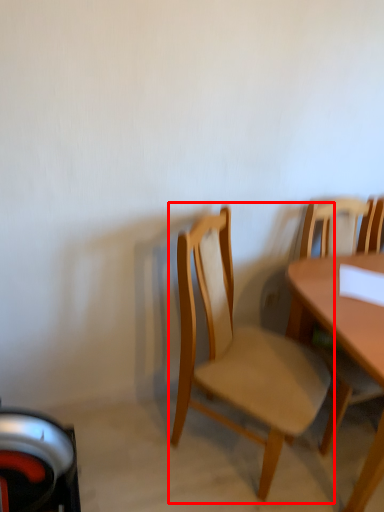
Question: Observing the image, what is the correct spatial positioning of chair (annotated by the red box) in reference to chair?

Choices:
 (A) right
 (B) left

Answer: (B)